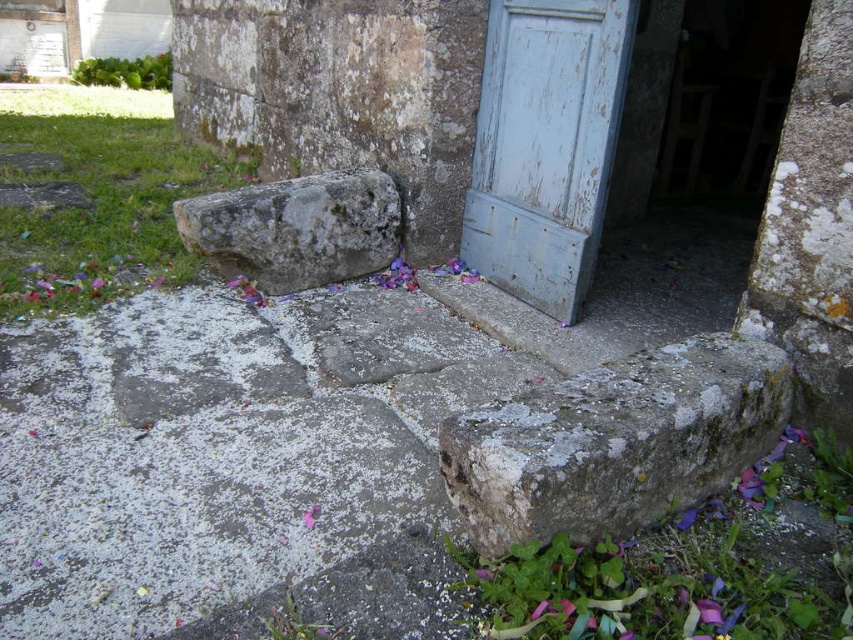
Is blue weathered wood door at center right to the right of pink paper flower at center from the viewer's perspective?

Correct, you'll find blue weathered wood door at center right to the right of pink paper flower at center.

Is blue weathered wood door at center right further to camera compared to pink paper flower at center?

Yes, blue weathered wood door at center right is behind pink paper flower at center.

Measure the distance between blue weathered wood door at center right and camera.

blue weathered wood door at center right is 2.28 meters from camera.

Find the location of a particular element. blue weathered wood door at center right is located at coordinates (544, 145).

Is point (773, 396) positioned in front of point (572, 285)?

Yes, point (773, 396) is closer to viewer.

This screenshot has height=640, width=853. I want to click on lichen-covered stone at lower right, so click(x=614, y=442).

Who is higher up, lichen-covered stone at lower right or gray rough stone at center?

Positioned higher is gray rough stone at center.

Does lichen-covered stone at lower right appear on the left side of gray rough stone at center?

No, lichen-covered stone at lower right is not to the left of gray rough stone at center.

Locate an element on the screen. lichen-covered stone at lower right is located at coordinates (614, 442).